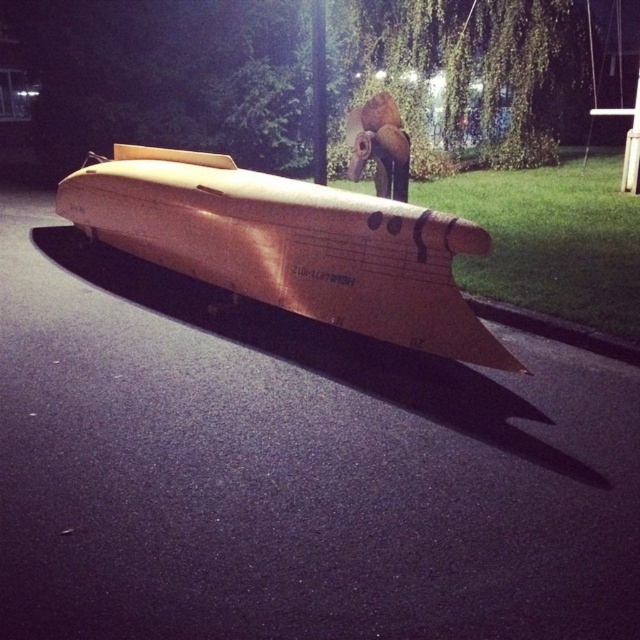
Find the location of a particular element. This screenshot has width=640, height=640. matte gold boat at center is located at coordinates (289, 244).